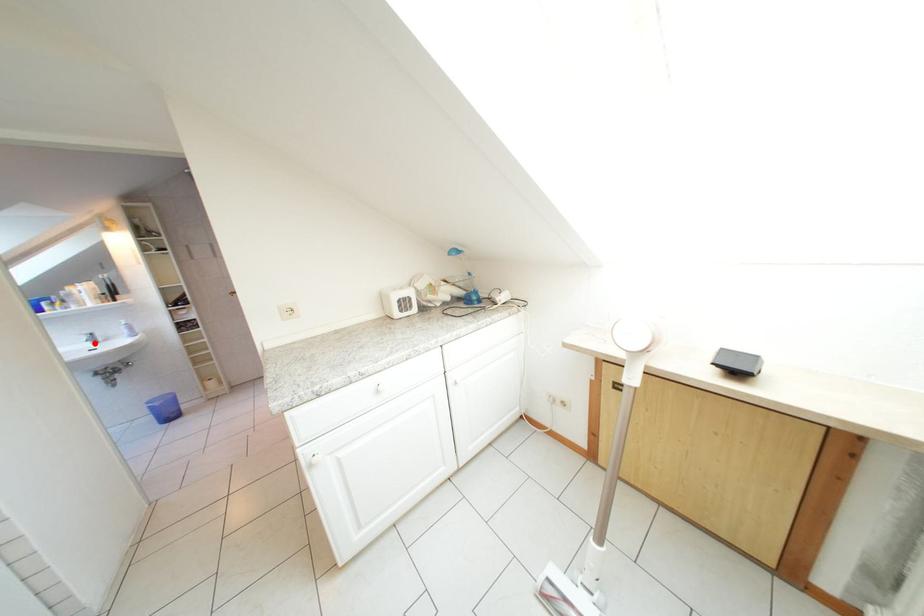
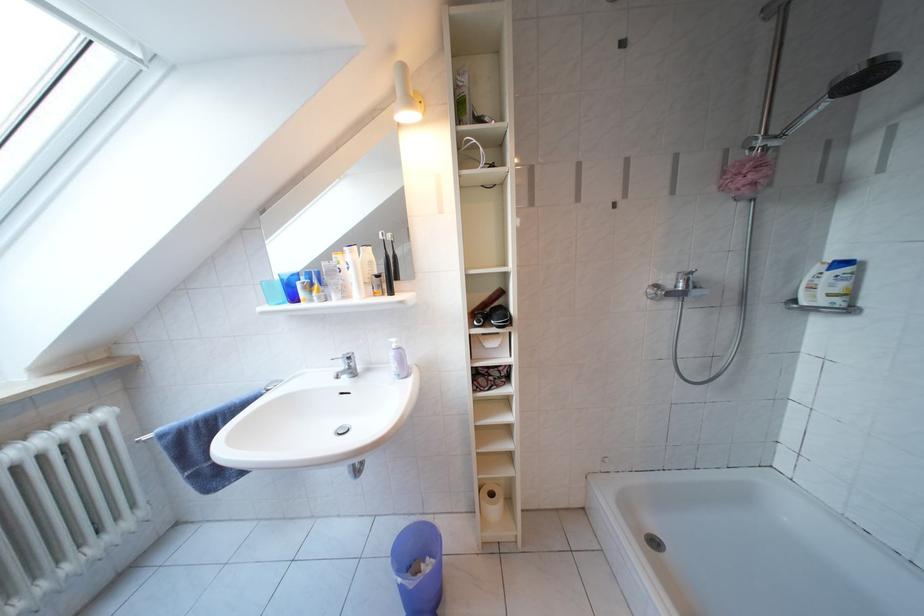
Question: I am providing you with two images of the same scene from different viewpoints. A red point is marked on the first image. At the location where the point appears in image 1, is it still visible in image 2?

Choices:
 (A) Yes
 (B) No

Answer: (A)